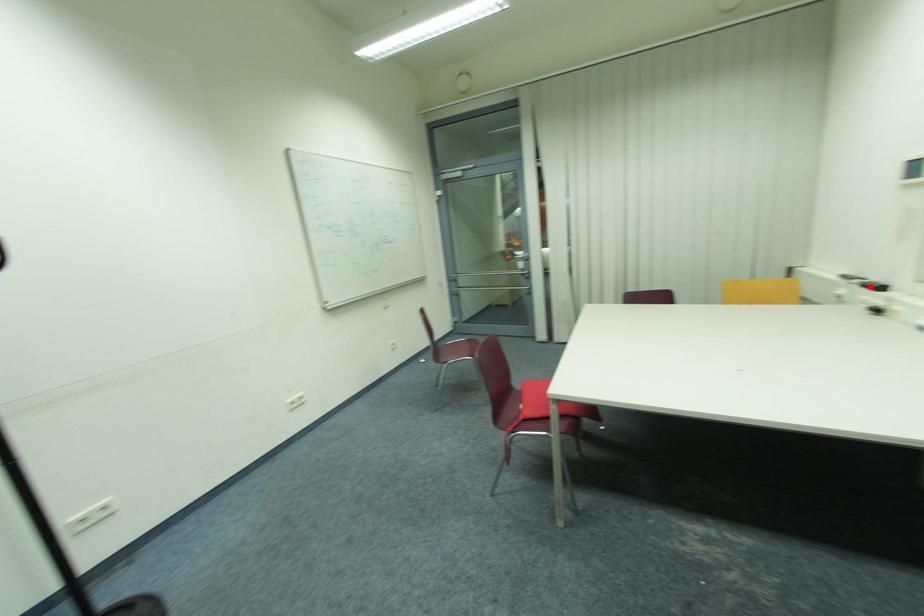
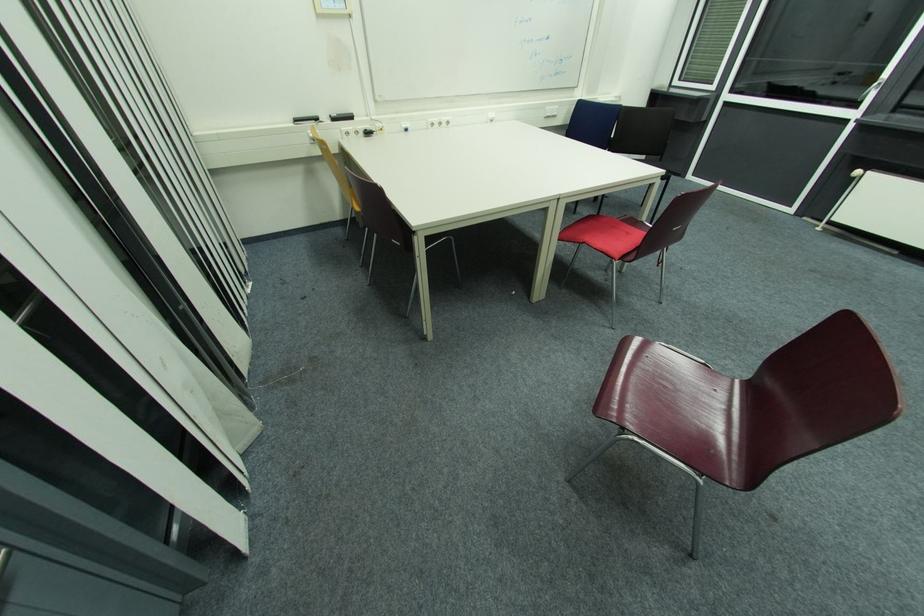
The point at the highlighted location is marked in the first image. Where is the corresponding point in the second image?

(337, 121)